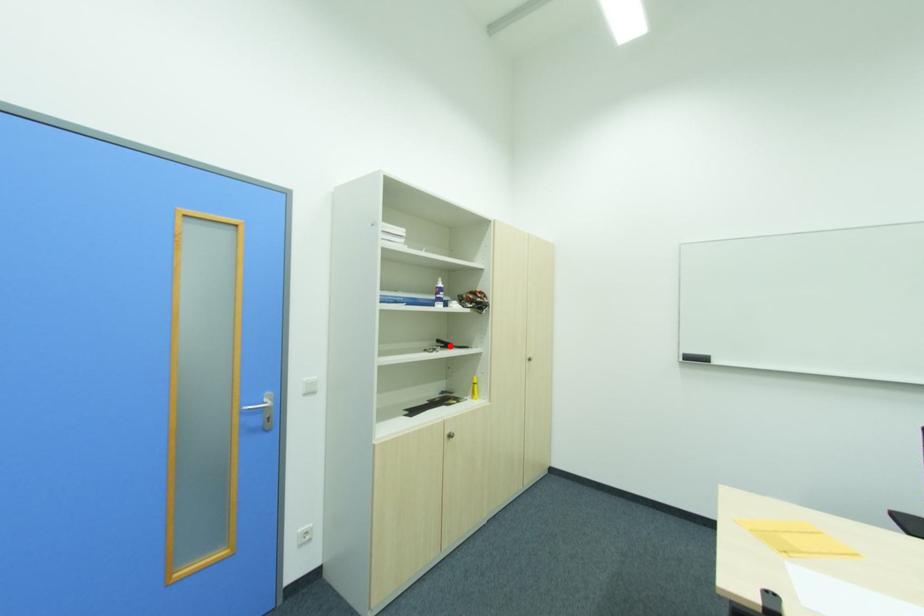
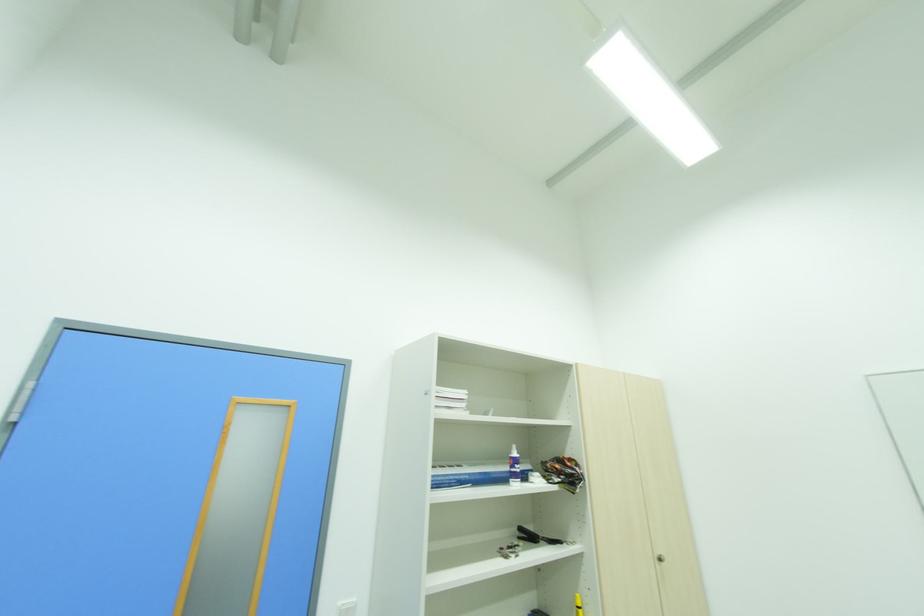
Where in the second image is the point corresponding to the highlighted location from the first image?

(536, 539)